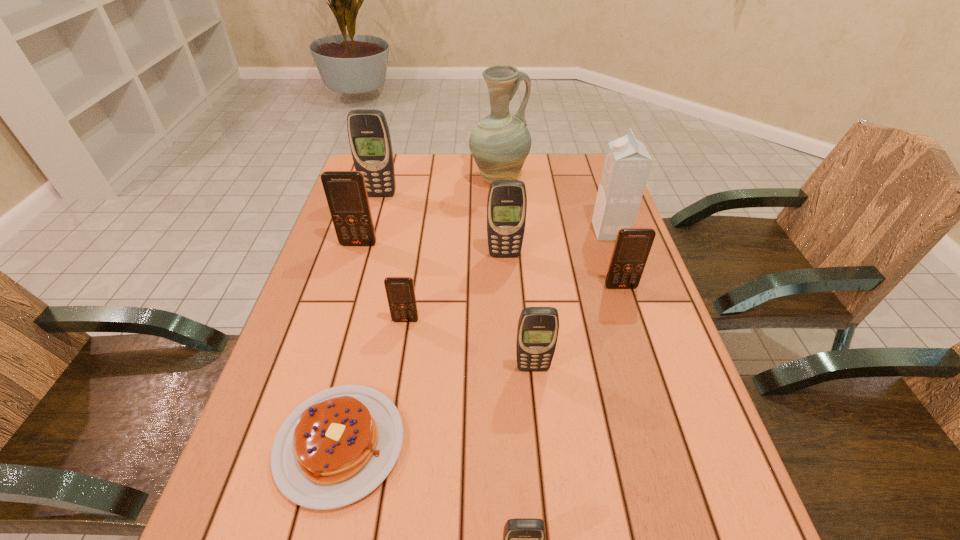
Where is `the tallest object`? the tallest object is located at coordinates (500, 143).

This screenshot has height=540, width=960. In order to click on carton in this screenshot , I will do `click(627, 164)`.

Find the location of a particular element. Image resolution: width=960 pixels, height=540 pixels. the biggest gray cellular telephone is located at coordinates (369, 137).

The image size is (960, 540). Identify the location of the farthest gray cellular telephone. (369, 137).

At what (x,y) coordinates should I click in order to perform the action: click on the farthest orange cellular telephone. Please return your answer as a coordinate pair (x, y). Looking at the image, I should click on (346, 194).

Find the location of a particular element. The width and height of the screenshot is (960, 540). the second farthest cellular telephone is located at coordinates (346, 194).

Locate an element on the screen. The image size is (960, 540). the third nearest gray cellular telephone is located at coordinates (507, 201).

Locate an element on the screen. Image resolution: width=960 pixels, height=540 pixels. the third farthest cellular telephone is located at coordinates (507, 201).

I want to click on the eighth farthest object, so click(537, 332).

Locate an element on the screen. The width and height of the screenshot is (960, 540). the third biggest gray cellular telephone is located at coordinates (537, 332).